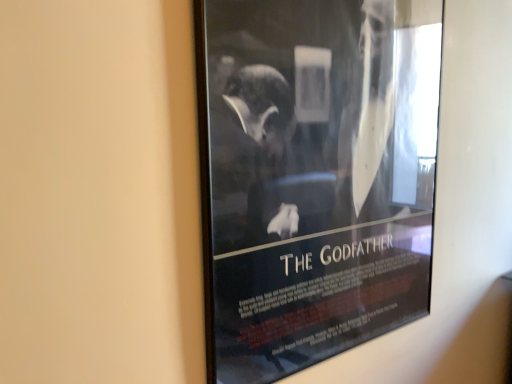
What do you see at coordinates (314, 176) in the screenshot? The height and width of the screenshot is (384, 512). I see `black glossy poster at center` at bounding box center [314, 176].

In order to click on black glossy poster at center in this screenshot , I will do `click(314, 176)`.

Where is `black glossy poster at center`? black glossy poster at center is located at coordinates (314, 176).